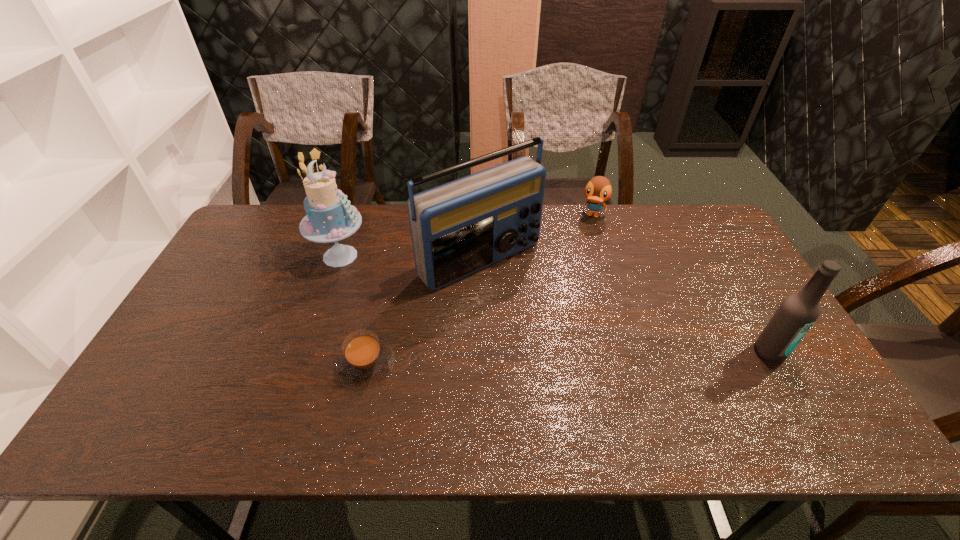
Identify the location of cappuccino. (365, 360).

Image resolution: width=960 pixels, height=540 pixels. I want to click on beer bottle, so click(x=798, y=312).

What are the coordinates of `the third tallest object` in the screenshot? It's located at (798, 312).

Where is `the third object from left to right`? the third object from left to right is located at coordinates click(x=458, y=228).

Locate an element on the screen. cake is located at coordinates (330, 217).

Find the location of `the second shortest object`. the second shortest object is located at coordinates (x=598, y=190).

Where is `the farthest object`? The image size is (960, 540). the farthest object is located at coordinates (598, 190).

What are the coordinates of `free space located 0.310m on the back of the shortest object` in the screenshot? It's located at (389, 262).

Find the location of a particular element. The height and width of the screenshot is (540, 960). vacant space located 0.070m on the label of the rightmost object is located at coordinates (790, 389).

Identify the location of blank area located on the front panel of the radio receiver. The width and height of the screenshot is (960, 540). (529, 300).